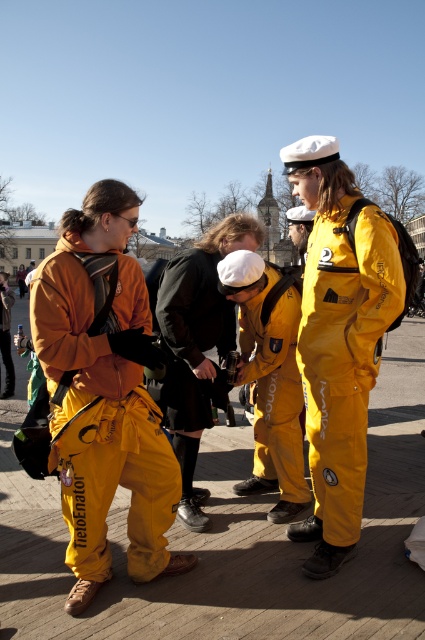
Who is lower down, matte orange jumpsuit at center or yellow fabric jacket at left?

matte orange jumpsuit at center

Between point (138, 577) and point (5, 276), which one is positioned behind?

The point (5, 276) is behind.

You are a GUI agent. You are given a task and a screenshot of the screen. Output one action in this format:
    pyautogui.click(x=<x>, y=<y>)
    Task: Click on the matte orange jumpsuit at center
    The image size is (425, 640).
    Given the screenshot: What is the action you would take?
    pyautogui.click(x=104, y=394)

Is matte orange jumpsuit at center further to camera compared to yellow matte uniform at center?

That is False.

Which is more to the right, matte orange jumpsuit at center or yellow matte uniform at center?

yellow matte uniform at center

Is point (150, 570) positioned before point (294, 349)?

That is True.

Locate an element on the screen. matte orange jumpsuit at center is located at coordinates click(x=104, y=394).

Is yellow waterproof suit at center further to the viewer compared to yellow fabric jacket at left?

No, it is in front of yellow fabric jacket at left.

Can you confirm if yellow waterproof suit at center is bigger than yellow fabric jacket at left?

No.

Is point (348, 401) in front of point (0, 392)?

Yes.

Locate an element on the screen. The height and width of the screenshot is (640, 425). yellow waterproof suit at center is located at coordinates (345, 355).